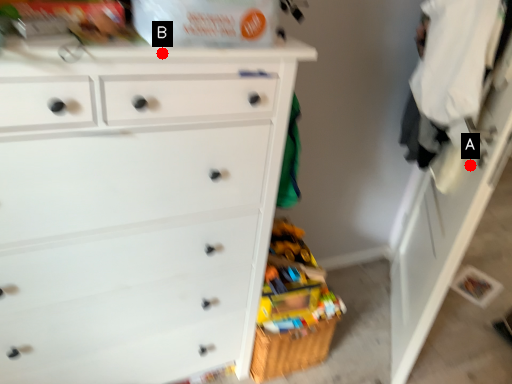
Question: Two points are circled on the image, labeled by A and B beside each circle. Which point is farther from the camera taking this photo?

Choices:
 (A) A is further
 (B) B is further

Answer: (A)